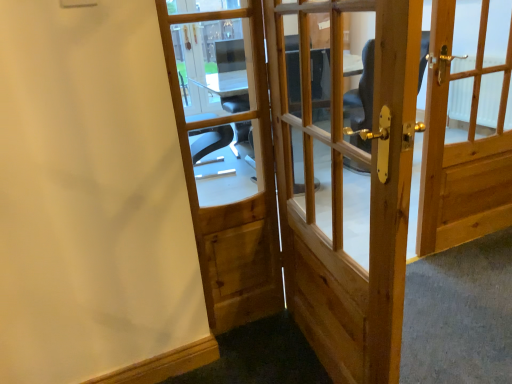
Locate an element on the screen. vacant region to the right of natural wood door at center, the 2th door when ordered from right to left is located at coordinates (451, 338).